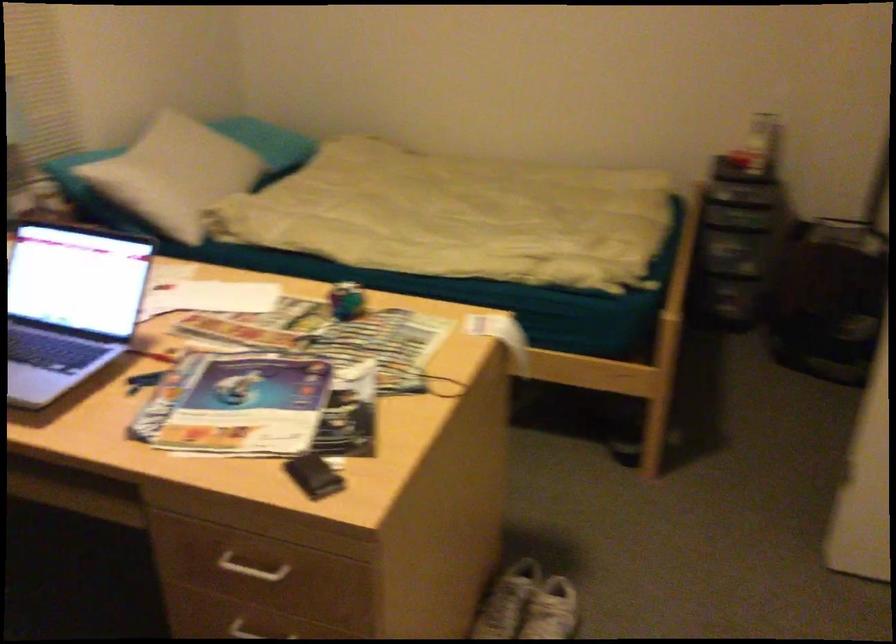
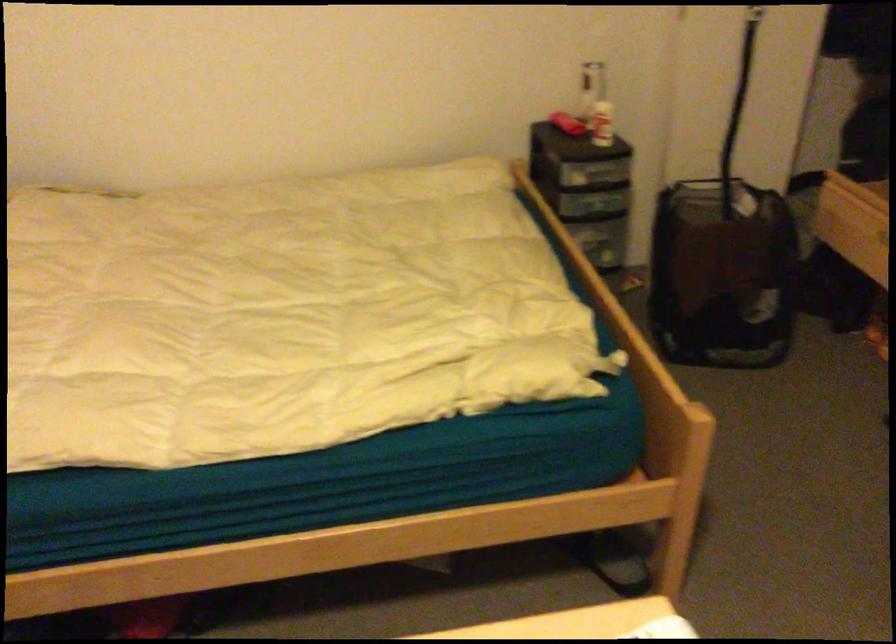
Question: Which direction would the cameraman need to move to produce the second image? Reply with the corresponding letter.

Choices:
 (A) Left
 (B) Right
 (C) Forward
 (D) Backward

Answer: (C)